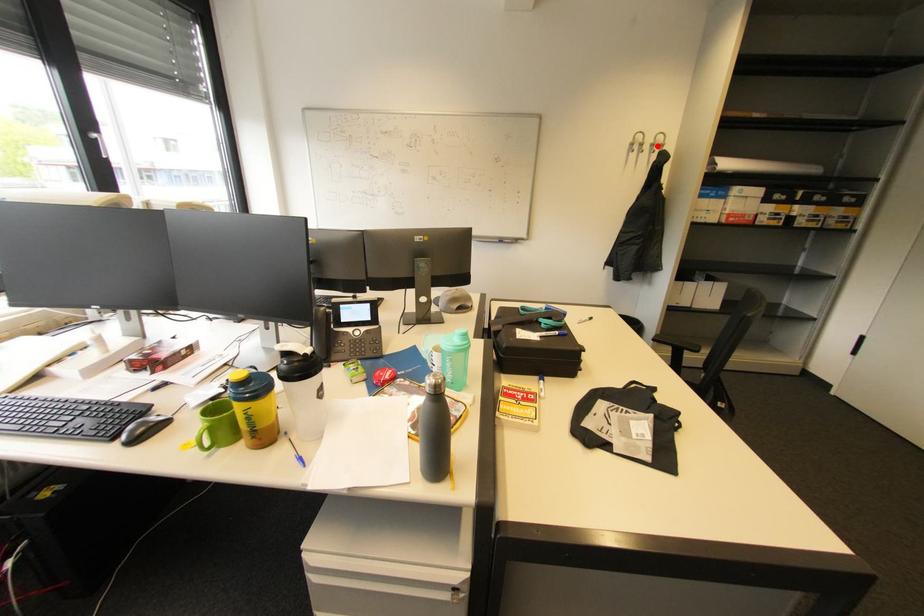
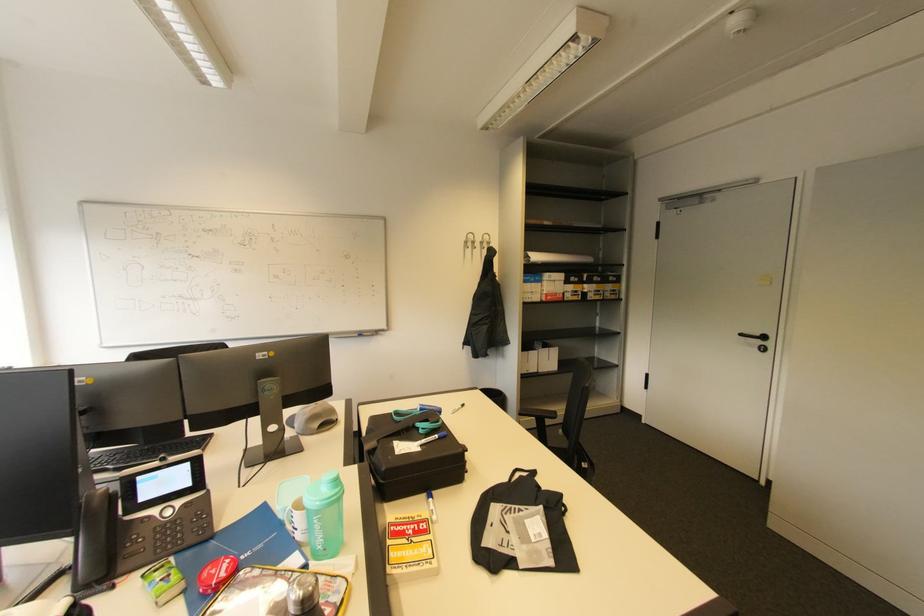
In the second image, find the point that corresponds to the highlighted location in the first image.

(487, 244)